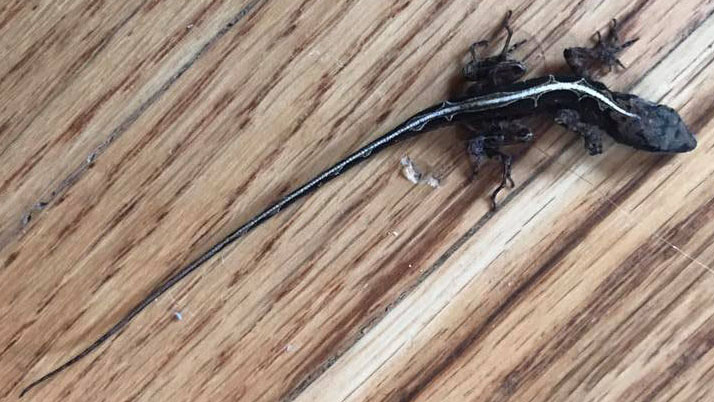
Where is `table`? table is located at coordinates (526, 309).